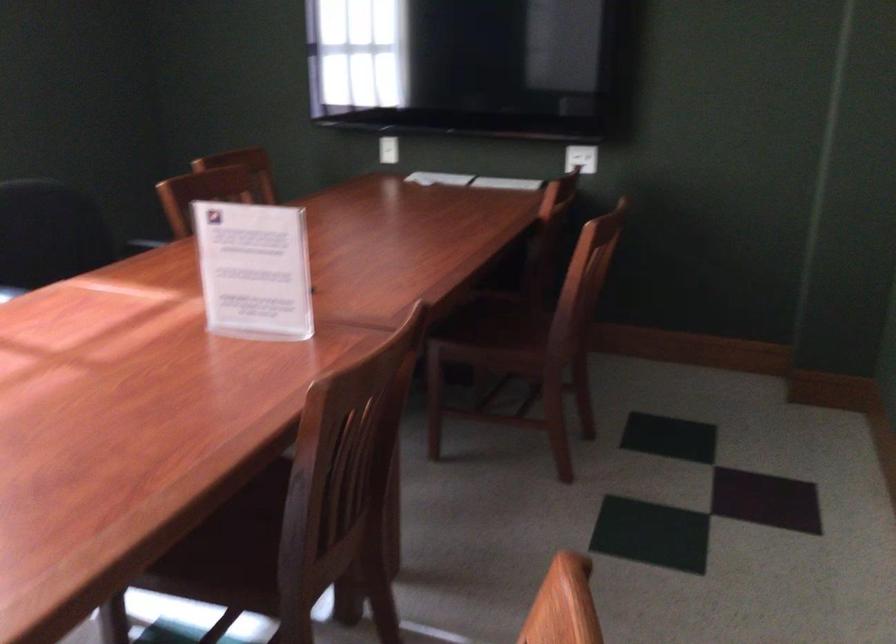
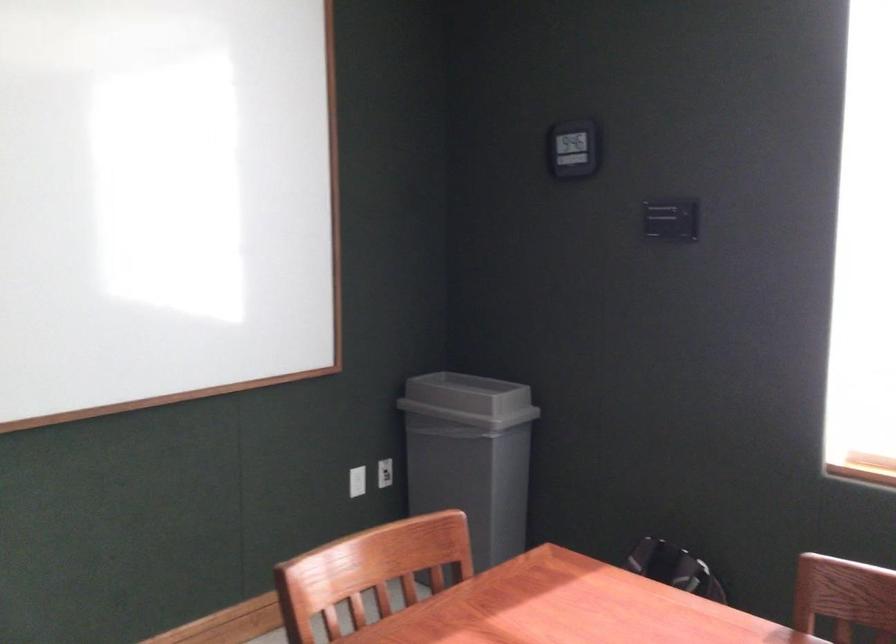
Question: The first image is from the beginning of the video and the second image is from the end. How did the camera likely rotate when shooting the video?

Choices:
 (A) Left
 (B) Right
 (C) Up
 (D) Down

Answer: (A)